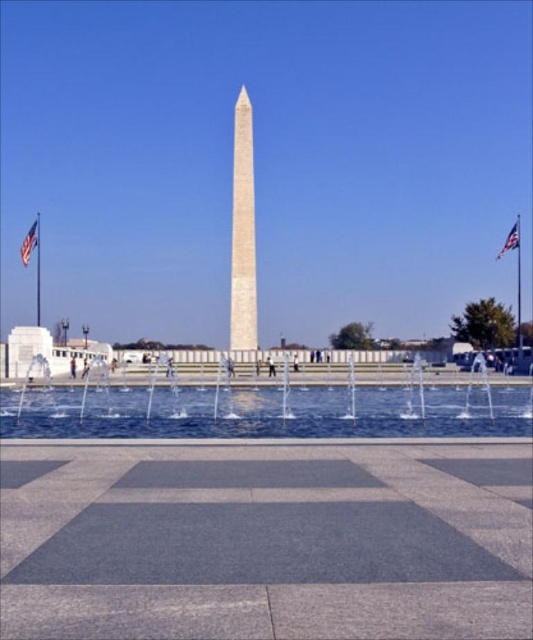
Question: Which of the following is the farthest from the observer?

Choices:
 (A) red fabric flag at upper left
 (B) white marble obelisk at center
 (C) american flag at upper right

Answer: (B)

Question: Which object is closer to the camera taking this photo?

Choices:
 (A) clear water at center
 (B) white marble obelisk at center
 (C) red fabric flag at upper left

Answer: (A)

Question: Observing the image, what is the correct spatial positioning of white marble obelisk at center in reference to red fabric flag at upper left?

Choices:
 (A) left
 (B) right

Answer: (B)

Question: Considering the relative positions of clear water at center and white marble obelisk at center in the image provided, where is clear water at center located with respect to white marble obelisk at center?

Choices:
 (A) below
 (B) above

Answer: (A)

Question: Can you confirm if red fabric flag at upper left is bigger than american flag at upper right?

Choices:
 (A) yes
 (B) no

Answer: (A)

Question: Which of the following is the farthest from the observer?

Choices:
 (A) (35, 246)
 (B) (497, 252)
 (C) (230, 296)

Answer: (B)